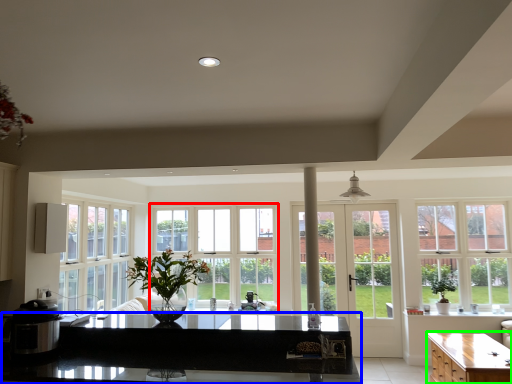
Question: Which object is the farthest from window (highlighted by a red box)? Choose among these: countertop (highlighted by a blue box) or cabinetry (highlighted by a green box).

Choices:
 (A) countertop
 (B) cabinetry

Answer: (B)